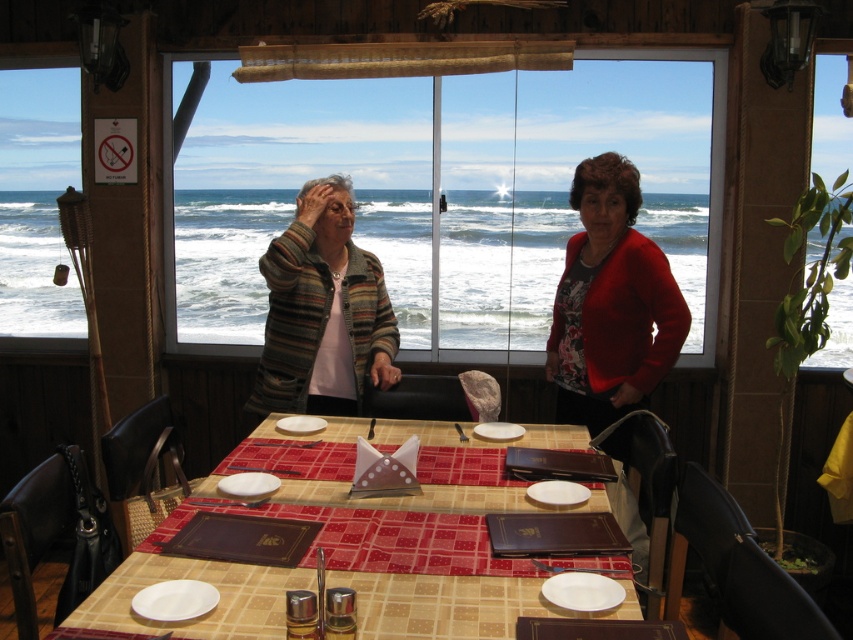
Question: Can you confirm if plaid fabric table at center is positioned to the right of striped sweater at center?

Choices:
 (A) no
 (B) yes

Answer: (A)

Question: Which object appears farthest from the camera in this image?

Choices:
 (A) plaid fabric table at center
 (B) striped sweater at center
 (C) striped wool sweater at center

Answer: (C)

Question: Can you confirm if plaid fabric table at center is positioned to the right of red sweater at center?

Choices:
 (A) no
 (B) yes

Answer: (A)

Question: Considering the real-world distances, which object is closest to the plaid fabric table at center?

Choices:
 (A) red sweater at center
 (B) striped wool sweater at center

Answer: (B)

Question: Does plaid fabric table at center appear over striped wool sweater at center?

Choices:
 (A) no
 (B) yes

Answer: (A)

Question: Which of these objects is positioned farthest from the red sweater at center?

Choices:
 (A) plaid fabric table at center
 (B) striped sweater at center

Answer: (A)